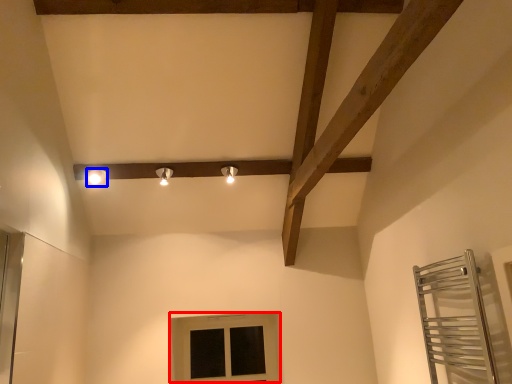
Question: Which object is further to the camera taking this photo, window (highlighted by a red box) or light fixture (highlighted by a blue box)?

Choices:
 (A) window
 (B) light fixture

Answer: (A)